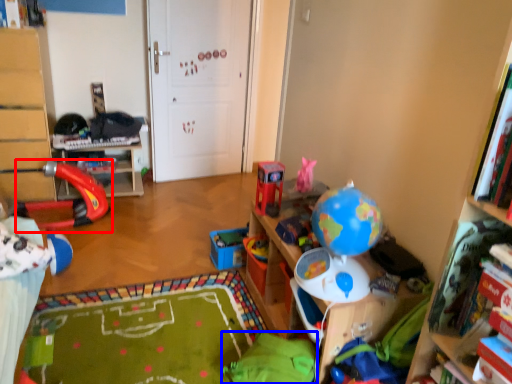
Question: Among these objects, which one is nearest to the camera, toy (highlighted by a red box) or bean bag chair (highlighted by a blue box)?

Choices:
 (A) toy
 (B) bean bag chair

Answer: (B)